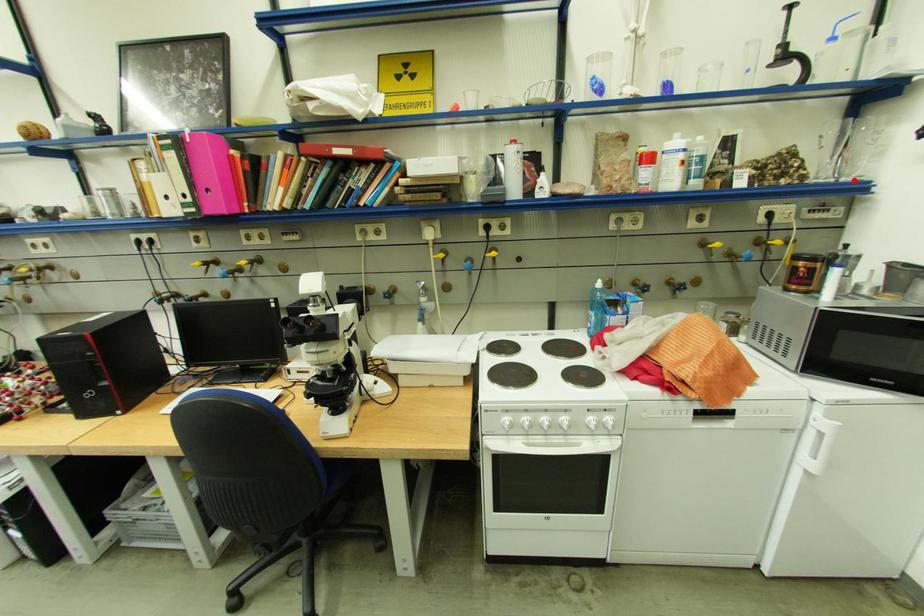
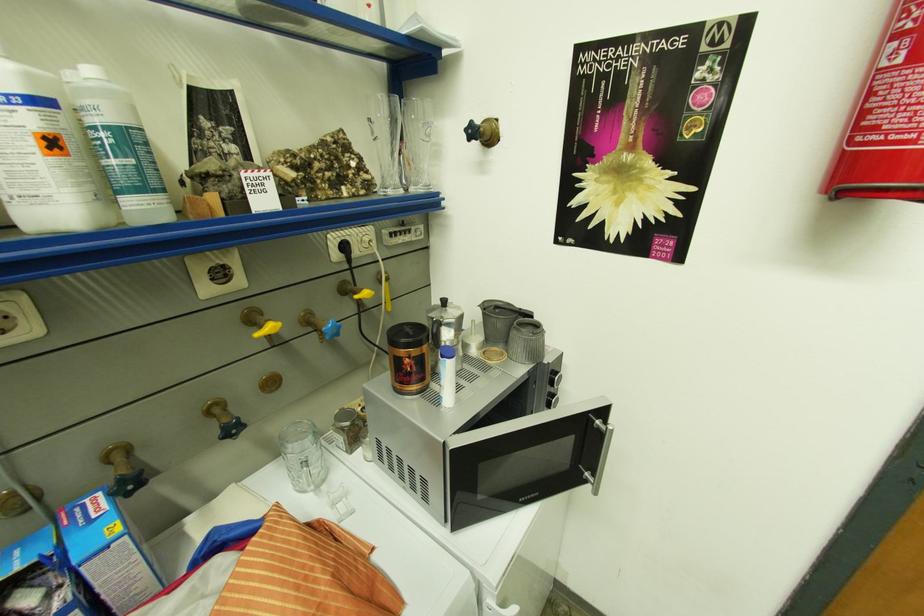
Question: A red point is marked in image1. In image2, is the corresponding 3D point closer to the camera or farther? Reply with the corresponding letter.

Choices:
 (A) The corresponding 3D point is closer.
 (B) The corresponding 3D point is farther.

Answer: (A)